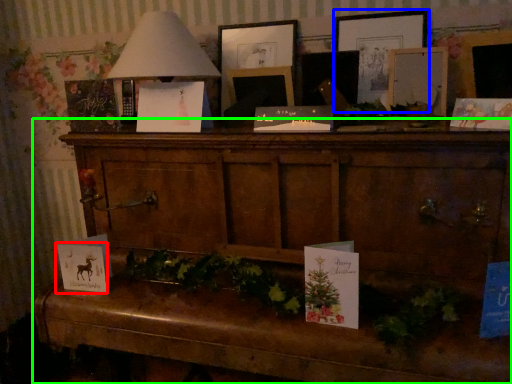
Question: Which object is the closest to the christmas card (highlighted by a red box)? Choose among these: picture frame (highlighted by a blue box) or furniture (highlighted by a green box).

Choices:
 (A) picture frame
 (B) furniture

Answer: (B)